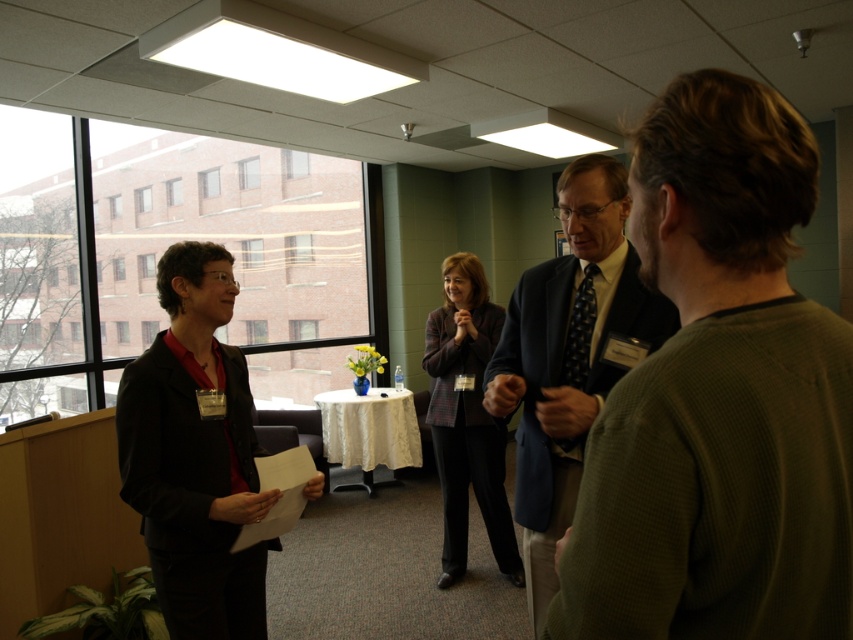
You are a photographer standing at the camera position. You want to take a closeup shot of the dark blue suit at center. Considering your current position, do you need to move closer or farther away to achieve this?

Since the distance between you and the dark blue suit at center is 5.27 feet, you need to move closer to take a closeup shot.

You are a photographer positioned at the camera. You want to take a closeup shot of the green textured sweater at right. Considering your current position, do you need to move closer or farther away to achieve this?

The green textured sweater at right is currently 27.25 inches away from the camera. To take a closeup shot, you would need to move closer to reduce the distance between the camera and the sweater.

You are a photographer setting up for a group photo in the conference room. You notice the dark blue suit at center and the plaid fabric blazer at center. Which clothing item should you adjust to ensure both are visible in the photo?

The dark blue suit at center is in front of the plaid fabric blazer at center, so you should adjust the plaid fabric blazer at center to move it forward so both are visible.